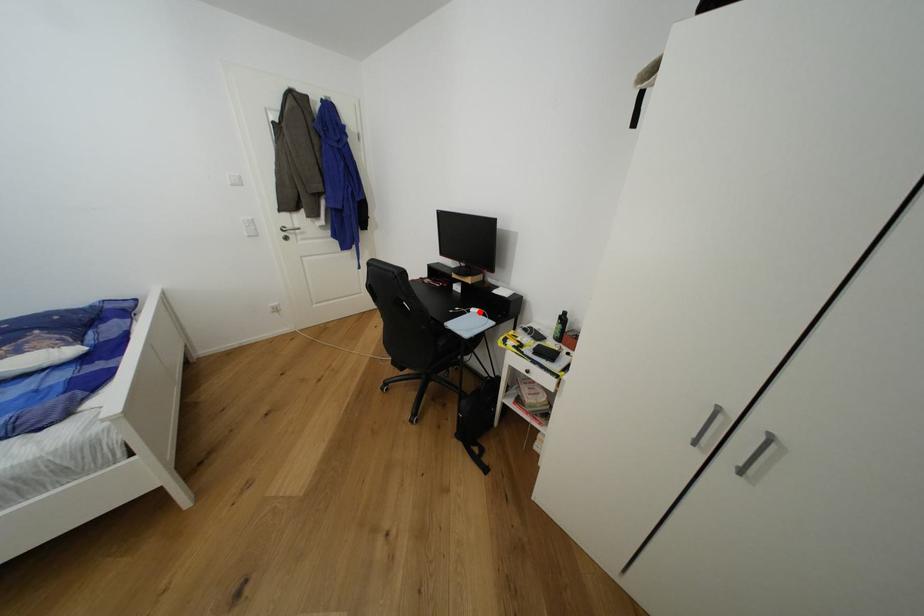
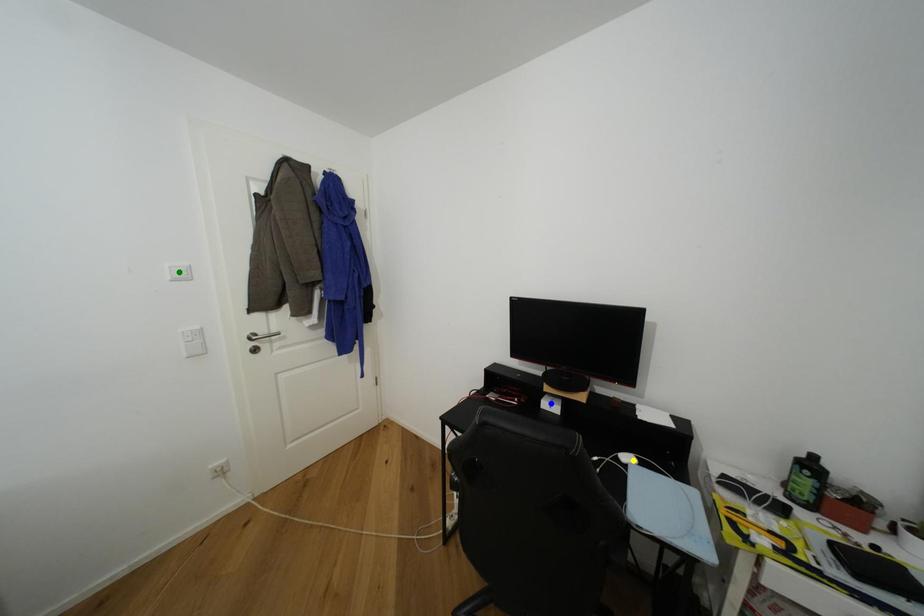
Question: I am providing you with two images of the same scene from different viewpoints. A red point is marked on the first image. You are given multiple points on the second image. Which point in image 2 represents the same 3d spot as the red point in image 1?

Choices:
 (A) yellow point
 (B) blue point
 (C) green point

Answer: (A)